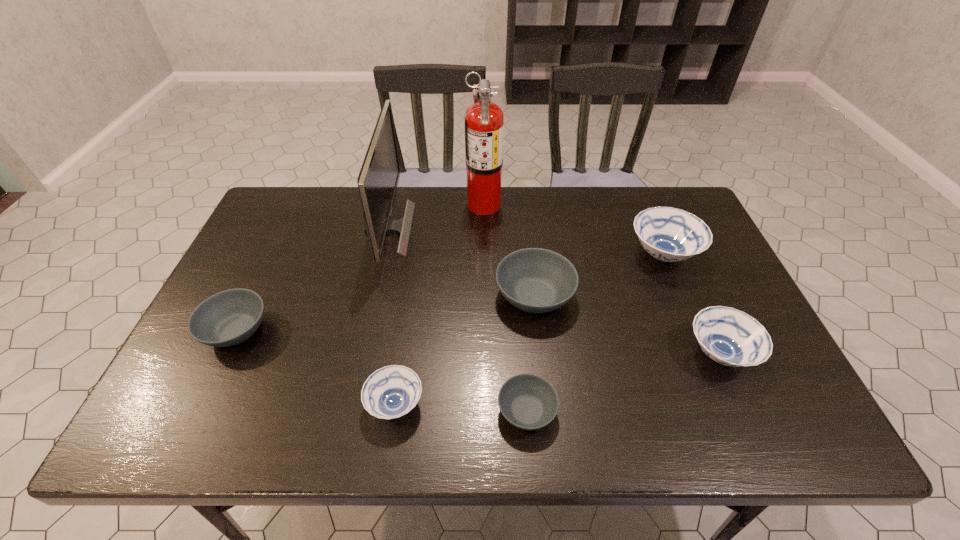
Identify the location of vacant region at the left edge of the desktop. (232, 351).

Find the location of a particular element. vacant space at the right edge of the desktop is located at coordinates (697, 264).

At what (x,y) coordinates should I click in order to perform the action: click on blank space at the near right corner of the desktop. Please return your answer as a coordinate pair (x, y). Looking at the image, I should click on (734, 427).

Where is `empty space between the monitor and the smallest blue soup bowl`? Image resolution: width=960 pixels, height=540 pixels. empty space between the monitor and the smallest blue soup bowl is located at coordinates (392, 316).

At what (x,y) coordinates should I click in order to perform the action: click on free point between the biggest gray soup bowl and the second smallest blue soup bowl. Please return your answer as a coordinate pair (x, y). The height and width of the screenshot is (540, 960). Looking at the image, I should click on (627, 325).

Where is `unoccupied area between the seventh shortest object and the biggest gray soup bowl`? unoccupied area between the seventh shortest object and the biggest gray soup bowl is located at coordinates (462, 262).

You are a GUI agent. You are given a task and a screenshot of the screen. Output one action in this format:
    pyautogui.click(x=<x>, y=<y>)
    Task: Click on the vacant space that's between the tallest object and the second biggest blue soup bowl
    This screenshot has width=960, height=540.
    Given the screenshot: What is the action you would take?
    pyautogui.click(x=602, y=279)

I want to click on empty space that is in between the smallest blue soup bowl and the biggest gray soup bowl, so click(x=465, y=350).

Locate an element on the screen. This screenshot has width=960, height=540. blank region between the second biggest blue soup bowl and the sixth shortest object is located at coordinates (691, 304).

The height and width of the screenshot is (540, 960). In order to click on vacant space that is in between the seventh shortest object and the leftmost gray soup bowl in this screenshot , I will do `click(312, 279)`.